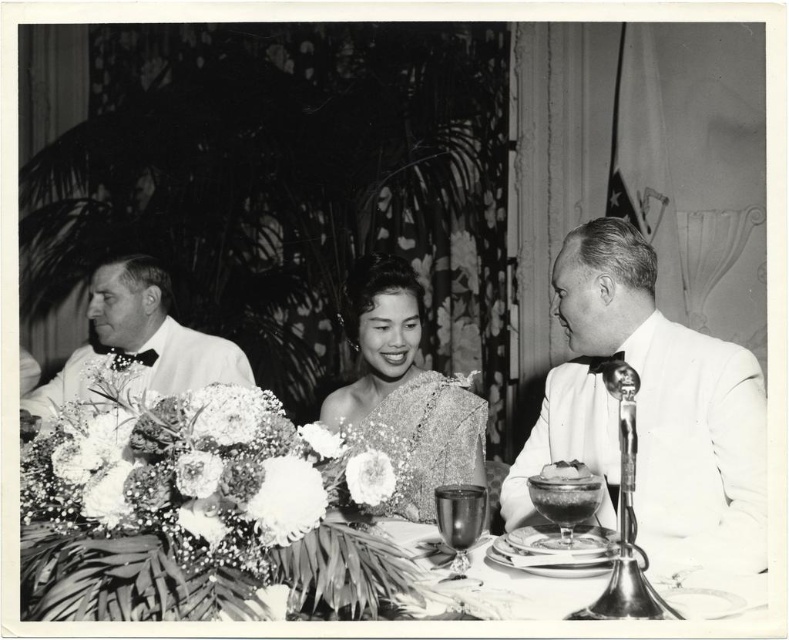
Can you confirm if white satin suit at right is shorter than shiny silver plate at center?

No.

In the scene shown: Which is more to the left, white satin suit at right or shiny silver plate at center?

From the viewer's perspective, shiny silver plate at center appears more on the left side.

Where is `white satin suit at right`? The width and height of the screenshot is (789, 640). white satin suit at right is located at coordinates (649, 410).

Image resolution: width=789 pixels, height=640 pixels. Identify the location of white satin suit at right. (649, 410).

Does shiny silver plate at center have a smaller size compared to satin cake at center?

Actually, shiny silver plate at center might be larger than satin cake at center.

Does point (331, 515) come behind point (574, 472)?

That is False.

Where is `shiny silver plate at center`? shiny silver plate at center is located at coordinates (522, 586).

I want to click on shiny silver plate at center, so click(x=522, y=586).

Is silky satin dress at center below matte white suit at left?

Yes.

Measure the distance between silky satin dress at center and matte white suit at left.

The distance of silky satin dress at center from matte white suit at left is 4.32 feet.

Find the location of a particular element. silky satin dress at center is located at coordinates [x=649, y=410].